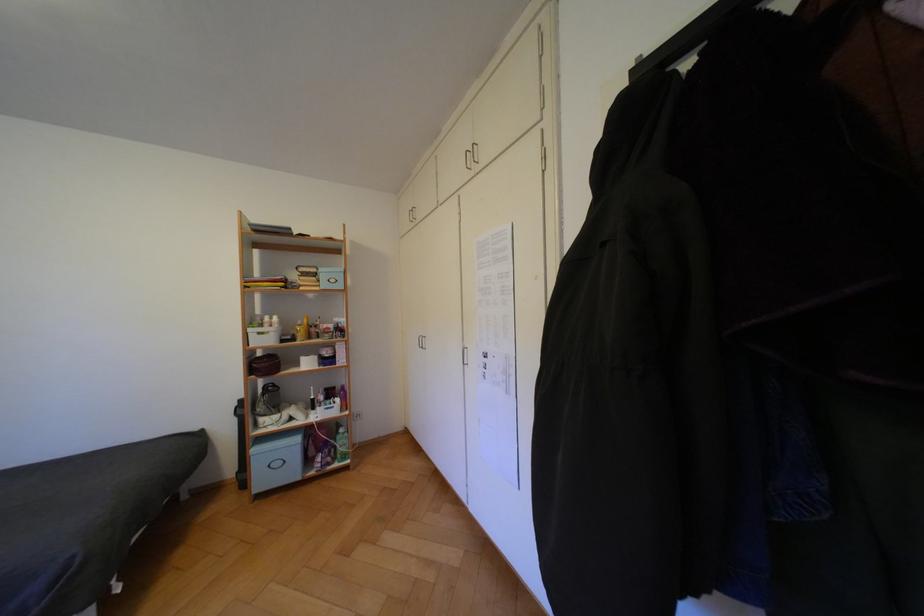
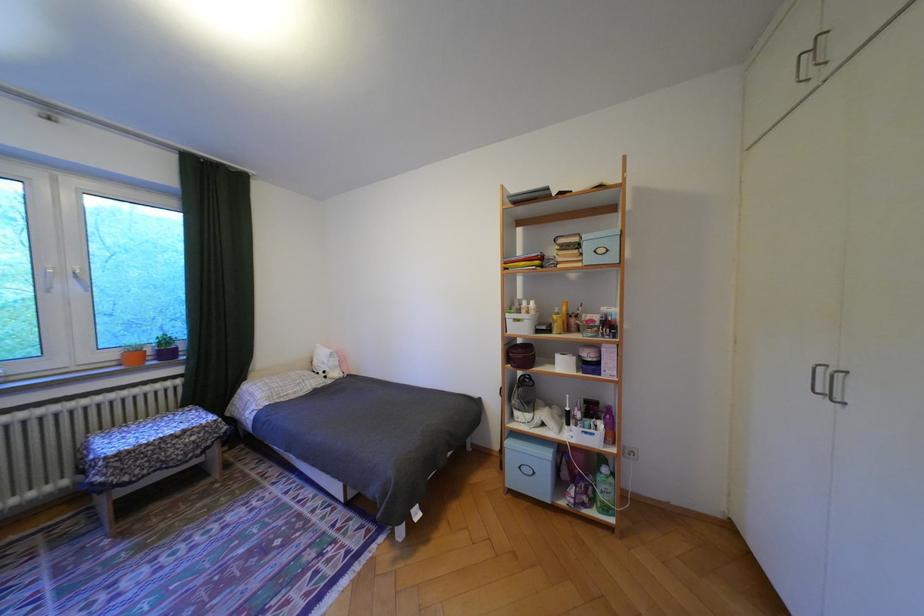
Where in the second image is the point corresponding to pixel 261 330 from the first image?

(518, 315)